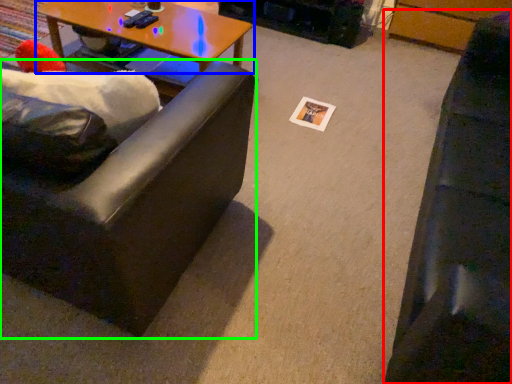
Question: Which is nearer to the studio couch (highlighted by a red box)? coffee table (highlighted by a blue box) or studio couch (highlighted by a green box).

Choices:
 (A) coffee table
 (B) studio couch

Answer: (B)